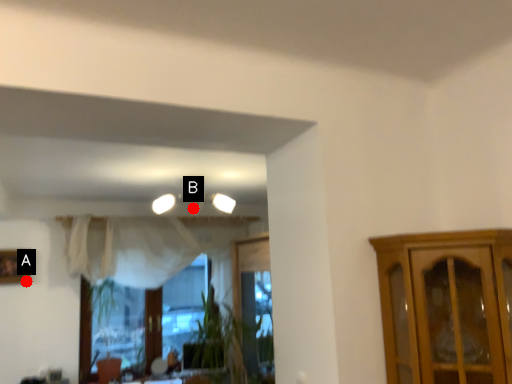
Question: Two points are circled on the image, labeled by A and B beside each circle. Which point is farther to the camera?

Choices:
 (A) A is further
 (B) B is further

Answer: (B)